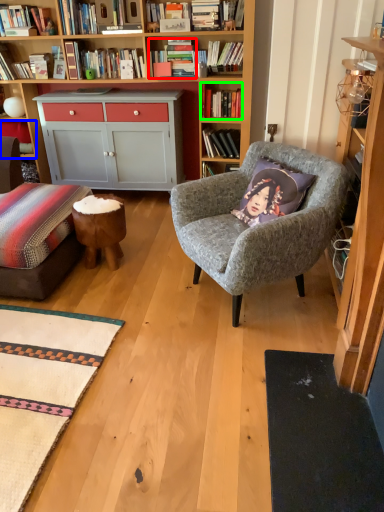
Question: Which object is the farthest from book (highlighted by a red box)? Choose among these: shelf (highlighted by a blue box) or book (highlighted by a green box).

Choices:
 (A) shelf
 (B) book

Answer: (A)